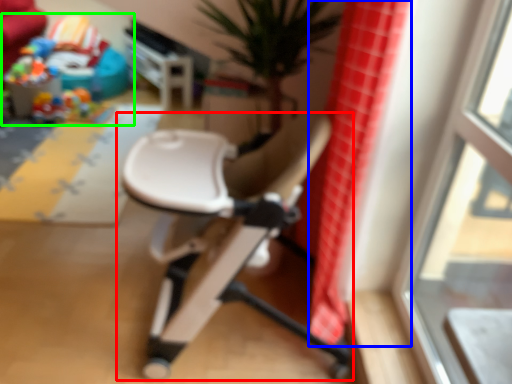
Question: Considering the real-world distances, which object is closest to chair (highlighted by a red box)? shower curtain (highlighted by a blue box) or toy (highlighted by a green box).

Choices:
 (A) shower curtain
 (B) toy

Answer: (A)